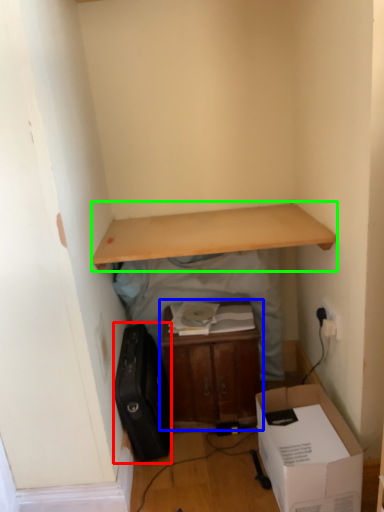
Question: Considering the real-world distances, which object is closest to luggage (highlighted by a red box)? table (highlighted by a blue box) or desk (highlighted by a green box).

Choices:
 (A) table
 (B) desk

Answer: (A)